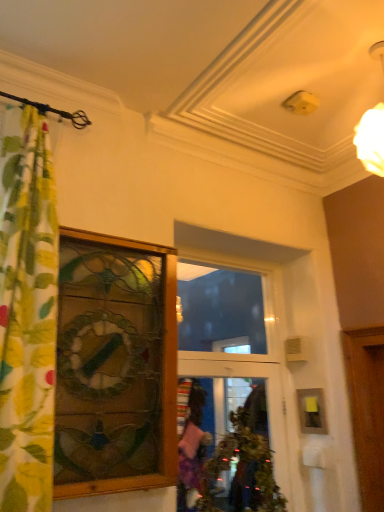
Question: From the image's perspective, is wooden picture frame at right above or below transparent glass window at center?

Choices:
 (A) above
 (B) below

Answer: (B)

Question: Relative to transparent glass window at center, is wooden picture frame at right in front or behind?

Choices:
 (A) front
 (B) behind

Answer: (B)

Question: Which object is the farthest from the wooden picture frame at right?

Choices:
 (A) transparent glass window at center
 (B) clear glass door at center
 (C) wooden stained glass window at left
 (D) green floral fabric curtain at left

Answer: (D)

Question: Estimate the real-world distances between objects in this image. Which object is closer to the wooden picture frame at right?

Choices:
 (A) transparent glass window at center
 (B) wooden stained glass window at left
 (C) green floral fabric curtain at left
 (D) clear glass door at center

Answer: (D)